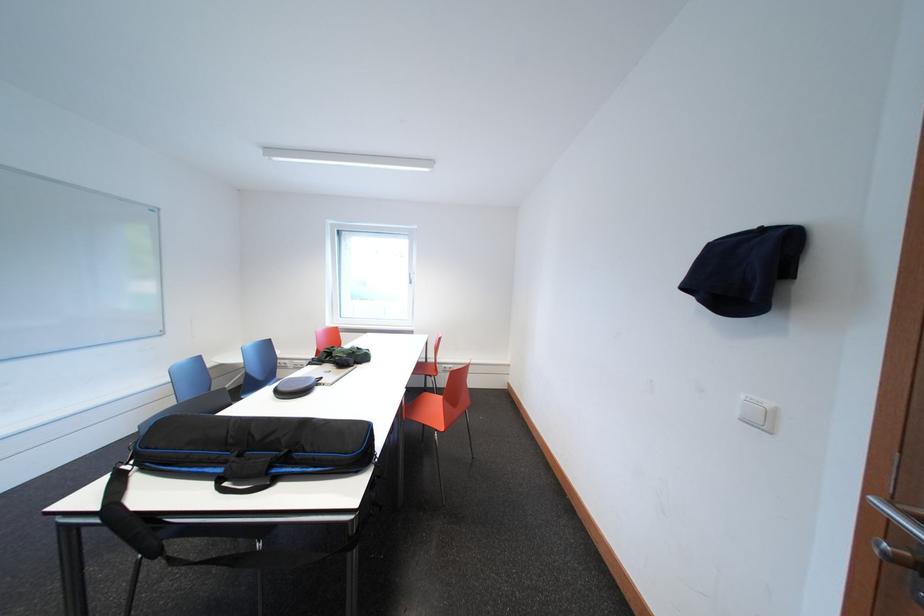
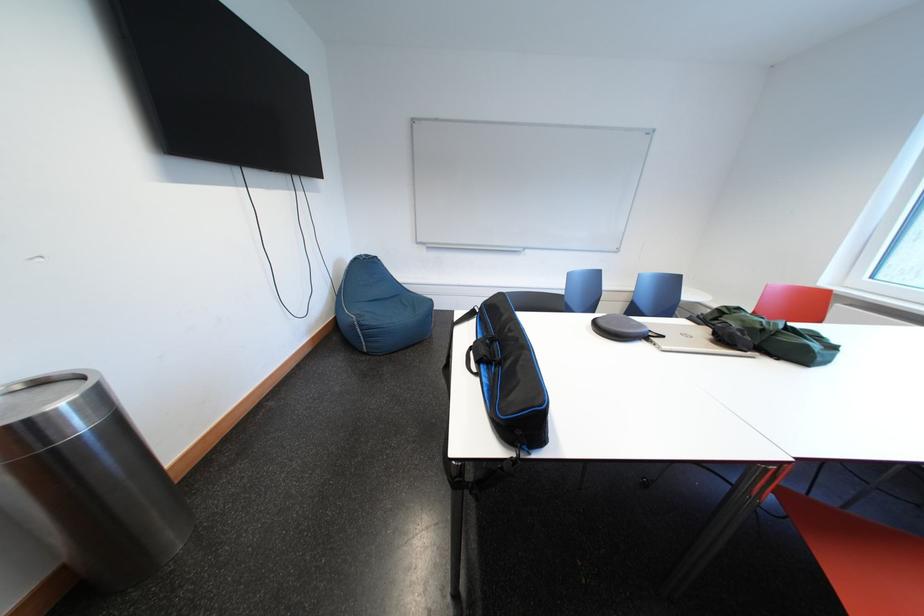
The point at (x=327, y=387) is marked in the first image. Where is the corresponding point in the second image?

(657, 341)